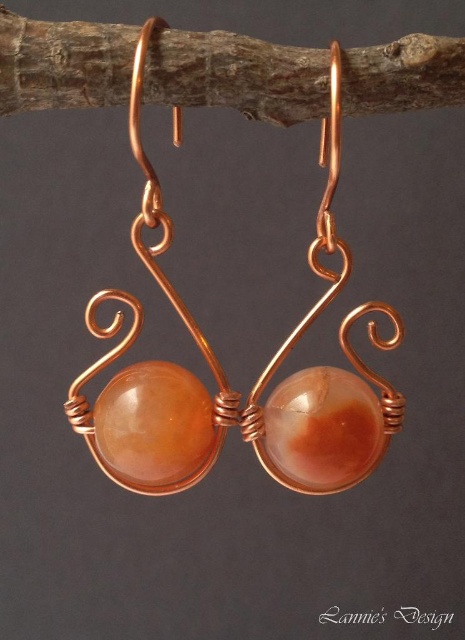
Is copper wire wrapped earrings at center below brown wood at upper center?

Yes.

Who is more distant from viewer, (192, 483) or (347, 93)?

Positioned behind is point (192, 483).

This screenshot has height=640, width=465. Identify the location of copper wire wrapped earrings at center. (224, 372).